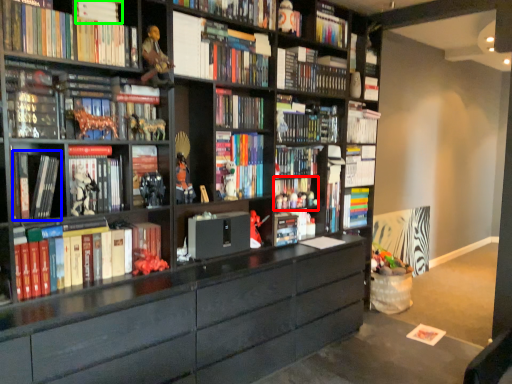
Question: Which object is positioned closest to book (highlighted by a red box)? Select from book (highlighted by a blue box) and book (highlighted by a green box).

Choices:
 (A) book
 (B) book

Answer: (A)